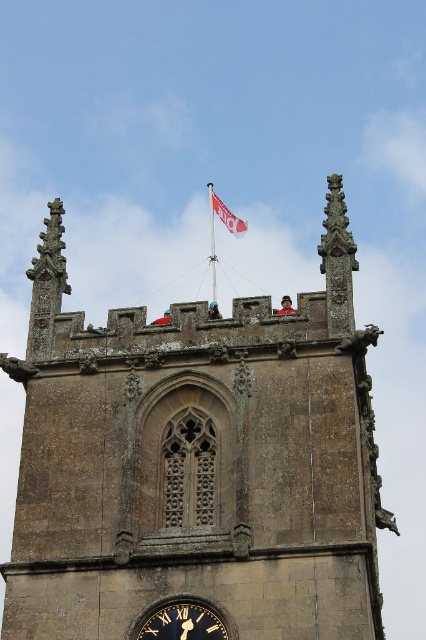
Question: Does brown stone church at upper center have a larger size compared to white fabric flag at upper center?

Choices:
 (A) no
 (B) yes

Answer: (B)

Question: Does brown stone church at upper center have a larger size compared to black metal clock at lower center?

Choices:
 (A) no
 (B) yes

Answer: (B)

Question: Which object appears farthest from the camera in this image?

Choices:
 (A) white fabric flag at upper center
 (B) black metal clock at lower center

Answer: (A)

Question: Which object is positioned farthest from the white fabric flag at upper center?

Choices:
 (A) brown stone church at upper center
 (B) black metal clock at lower center

Answer: (B)

Question: Which of the following is the closest to the observer?

Choices:
 (A) brown stone church at upper center
 (B) white fabric flag at upper center

Answer: (A)

Question: Is black metal clock at lower center above white fabric flag at upper center?

Choices:
 (A) no
 (B) yes

Answer: (A)